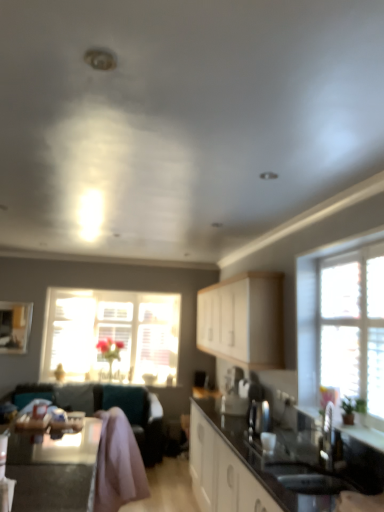
Question: Relative to teal fabric couch at lower left, is translucent glass window at center, which is the 1th window in back-to-front order, in front or behind?

Choices:
 (A) front
 (B) behind

Answer: (B)

Question: From a real-world perspective, is translucent glass window at center, which is the first window in left-to-right order, above or below teal fabric couch at lower left?

Choices:
 (A) below
 (B) above

Answer: (B)

Question: Which is farther from the satin silver kettle at center?

Choices:
 (A) translucent glass window at center, which is the first window in left-to-right order
 (B) white matte cabinet at center
 (C) white textured window at right, acting as the 1th window starting from the right
 (D) teal fabric couch at lower left
 (E) black glossy sink at lower right

Answer: (A)

Question: Based on their relative distances, which object is farther from the translucent glass window at center, which is the first window in left-to-right order?

Choices:
 (A) black glossy sink at lower right
 (B) black glossy table at lower left
 (C) teal fabric couch at lower left
 (D) black glossy countertop at center
 (E) white textured window at right, the 2th window when ordered from left to right

Answer: (A)